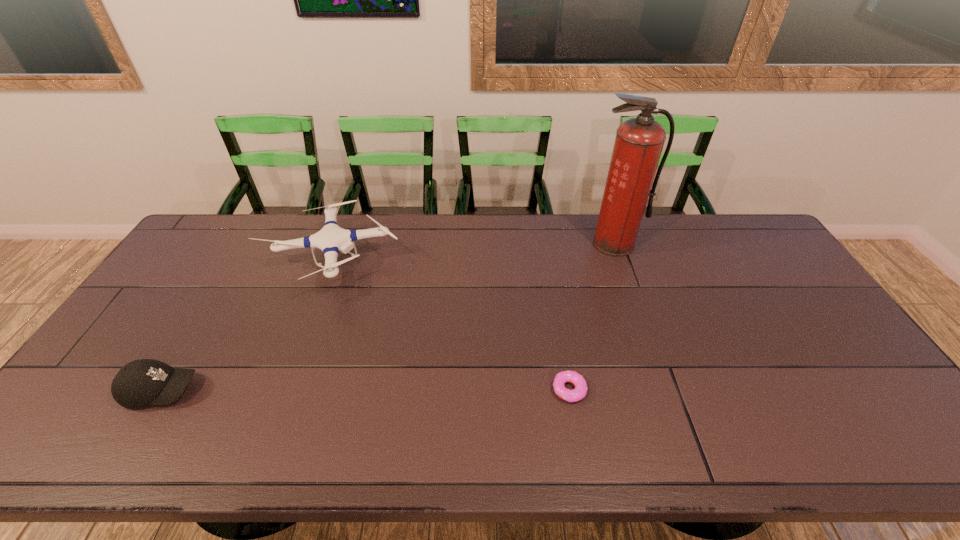
You are a GUI agent. You are given a task and a screenshot of the screen. Output one action in this format:
    pyautogui.click(x=<x>, y=<y>)
    Task: Click on the fire extinguisher at the far edge
    Image resolution: width=960 pixels, height=540 pixels.
    Given the screenshot: What is the action you would take?
    pyautogui.click(x=639, y=141)

The height and width of the screenshot is (540, 960). Identify the location of drone that is at the far edge. (331, 239).

The width and height of the screenshot is (960, 540). I want to click on object present at the left edge, so click(x=141, y=382).

Locate an element on the screen. The height and width of the screenshot is (540, 960). vacant space at the far edge of the desktop is located at coordinates (478, 244).

Image resolution: width=960 pixels, height=540 pixels. What are the coordinates of `vacant space at the near edge of the desktop` in the screenshot? It's located at (402, 445).

The width and height of the screenshot is (960, 540). I want to click on vacant region at the left edge of the desktop, so click(x=184, y=269).

In the image, there is a desktop. Where is `free space at the right edge`? free space at the right edge is located at coordinates (774, 316).

In the image, there is a desktop. Where is `vacant area at the far left corner`? The width and height of the screenshot is (960, 540). vacant area at the far left corner is located at coordinates (246, 230).

The width and height of the screenshot is (960, 540). In the image, there is a desktop. Find the location of `vacant space at the far right corner`. vacant space at the far right corner is located at coordinates (752, 254).

I want to click on vacant area that lies between the drone and the rightmost object, so click(473, 254).